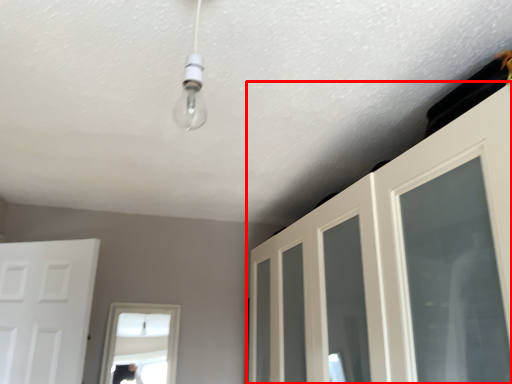
Question: From the image's perspective, where is door (annotated by the red box) located relative to door?

Choices:
 (A) above
 (B) below

Answer: (A)